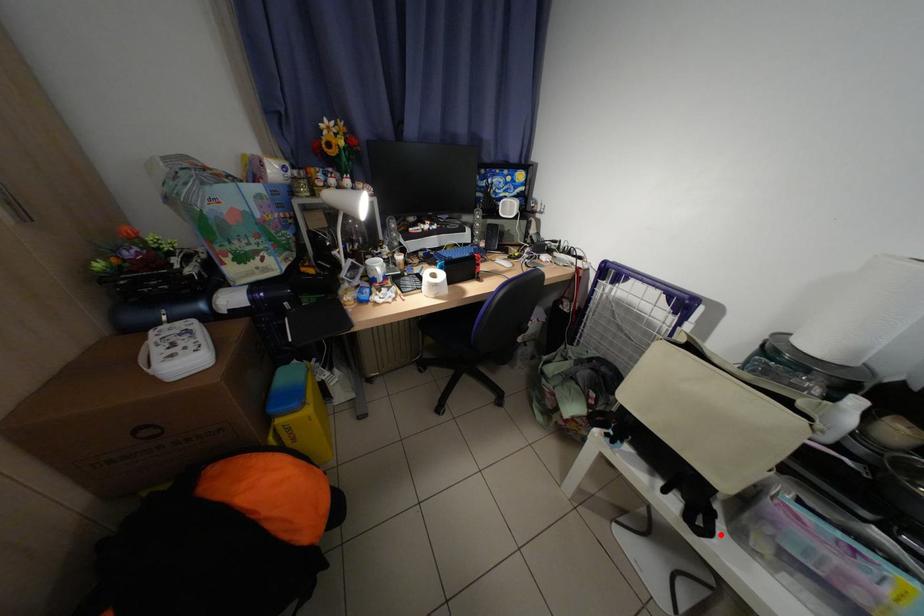
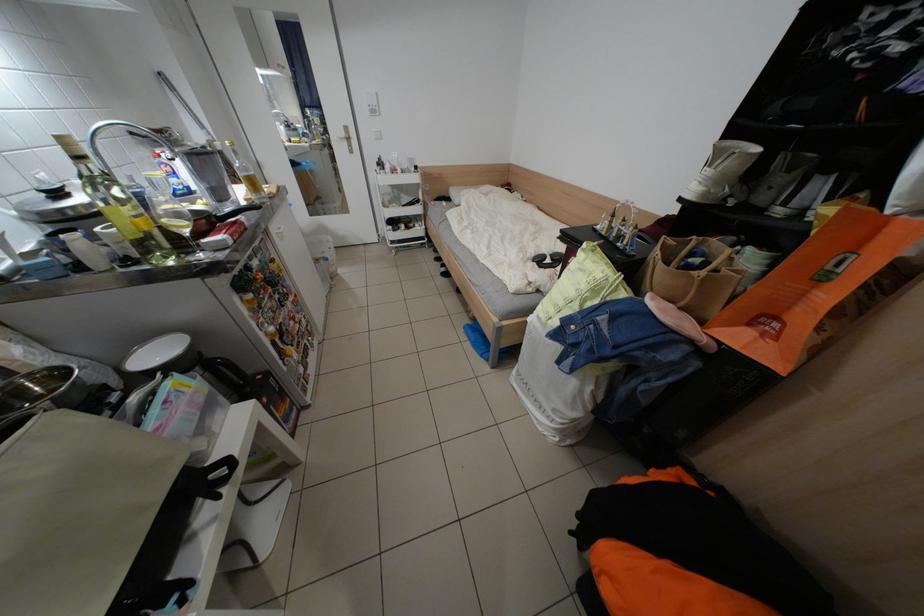
Find the pixel in the second image that matches the highlighted location in the first image.

(238, 463)